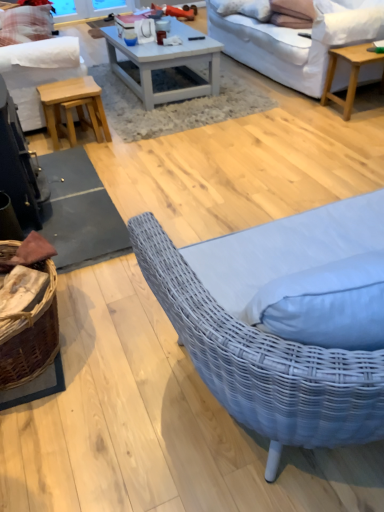
Identify the location of free space in front of light wood/texture coffee table at upper right, marked as the second coffee table in a left-to-right arrangement. (363, 131).